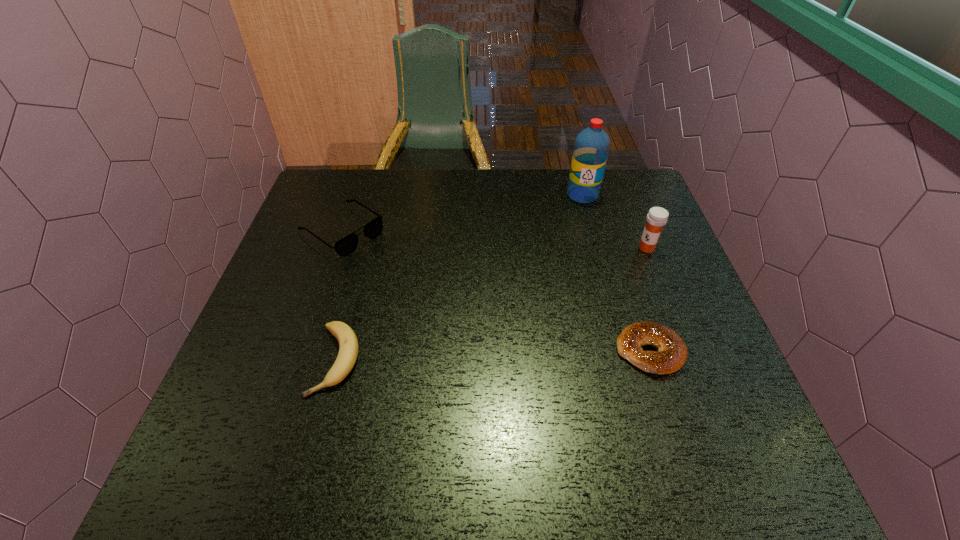
This screenshot has height=540, width=960. I want to click on vacant space at the near right corner of the desktop, so click(x=682, y=414).

Find the location of a particular element. vacant space in between the bagel and the third tallest object is located at coordinates [x=495, y=291].

Locate an element on the screen. vacant area that lies between the bagel and the farthest object is located at coordinates (615, 273).

This screenshot has width=960, height=540. In order to click on free space that is in between the bagel and the spectacles in this screenshot , I will do `click(495, 291)`.

Locate an element on the screen. vacant region between the banana and the third tallest object is located at coordinates (339, 295).

This screenshot has height=540, width=960. What are the coordinates of `blank region between the third shortest object and the second tallest object` in the screenshot? It's located at (494, 239).

What are the coordinates of `vacant space that's between the banana and the water bottle` in the screenshot? It's located at (459, 278).

Where is `free spot between the banana and the farthest object`? Image resolution: width=960 pixels, height=540 pixels. free spot between the banana and the farthest object is located at coordinates (459, 278).

I want to click on empty space that is in between the tallest object and the bagel, so click(615, 273).

Locate an element on the screen. The height and width of the screenshot is (540, 960). unoccupied position between the farthest object and the third shortest object is located at coordinates (463, 213).